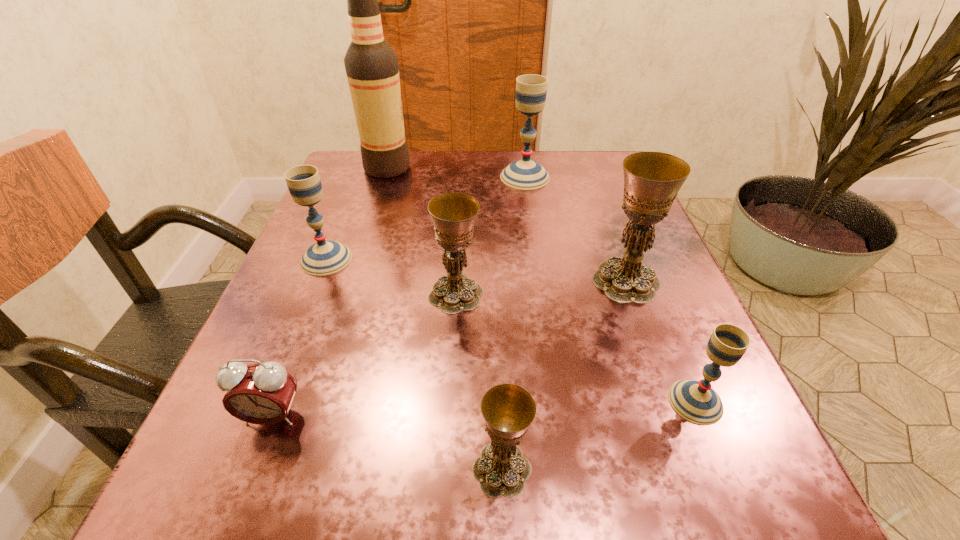
You are a GUI agent. You are given a task and a screenshot of the screen. Output one action in this format:
    pyautogui.click(x=<x>, y=<y>)
    Task: Click on the gray chalice that is the second closest to the second smallest gold chalice
    
    Given the screenshot: What is the action you would take?
    (x=695, y=401)

Choose which gray chalice is the nearest neighbor to the pink alarm clock. Please provide its 2D coordinates. Your answer should be formatted as a tuple, i.e. [(x, y)], where the tuple contains the x and y coordinates of a point satisfying the conditions above.

[(325, 257)]

Choose which gold chalice is the nearest neighbor to the second biggest gold chalice. Please provide its 2D coordinates. Your answer should be formatted as a tuple, i.e. [(x, y)], where the tuple contains the x and y coordinates of a point satisfying the conditions above.

[(652, 180)]

Locate an element on the screen. The width and height of the screenshot is (960, 540). the closest gold chalice relative to the second biggest gold chalice is located at coordinates (652, 180).

Image resolution: width=960 pixels, height=540 pixels. Find the location of `vacant position in the image that satisfies the following two spatial constraints: 1. on the label of the tallest object; 2. on the right side of the farthest chalice`. vacant position in the image that satisfies the following two spatial constraints: 1. on the label of the tallest object; 2. on the right side of the farthest chalice is located at coordinates (384, 177).

The height and width of the screenshot is (540, 960). Find the location of `free space that satisfies the following two spatial constraints: 1. on the label of the biggest gold chalice; 2. on the right side of the alcohol`. free space that satisfies the following two spatial constraints: 1. on the label of the biggest gold chalice; 2. on the right side of the alcohol is located at coordinates (350, 281).

You are a GUI agent. You are given a task and a screenshot of the screen. Output one action in this format:
    pyautogui.click(x=<x>, y=<y>)
    Task: Click on the free region that satisfies the following two spatial constraints: 1. on the label of the beige alcohol; 2. on the left side of the nearest chalice
    The width and height of the screenshot is (960, 540).
    Given the screenshot: What is the action you would take?
    [291, 469]

Where is `vacant position in the image that satisfies the following two spatial constraints: 1. on the back side of the second gray chalice from left to right; 2. on the label of the beige alcohol`? vacant position in the image that satisfies the following two spatial constraints: 1. on the back side of the second gray chalice from left to right; 2. on the label of the beige alcohol is located at coordinates (523, 168).

The height and width of the screenshot is (540, 960). I want to click on vacant space that satisfies the following two spatial constraints: 1. on the clock face of the nearest chalice; 2. on the right side of the shortest object, so click(x=252, y=469).